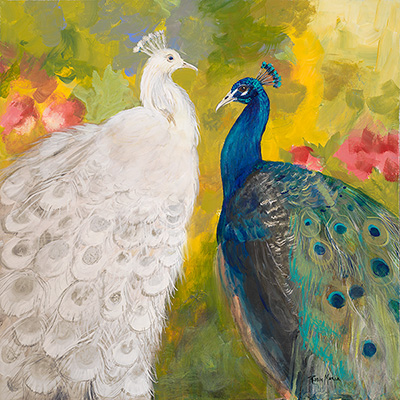
Find the location of a particular element. Image resolution: width=400 pixels, height=400 pixels. chest is located at coordinates (188, 178), (243, 269).